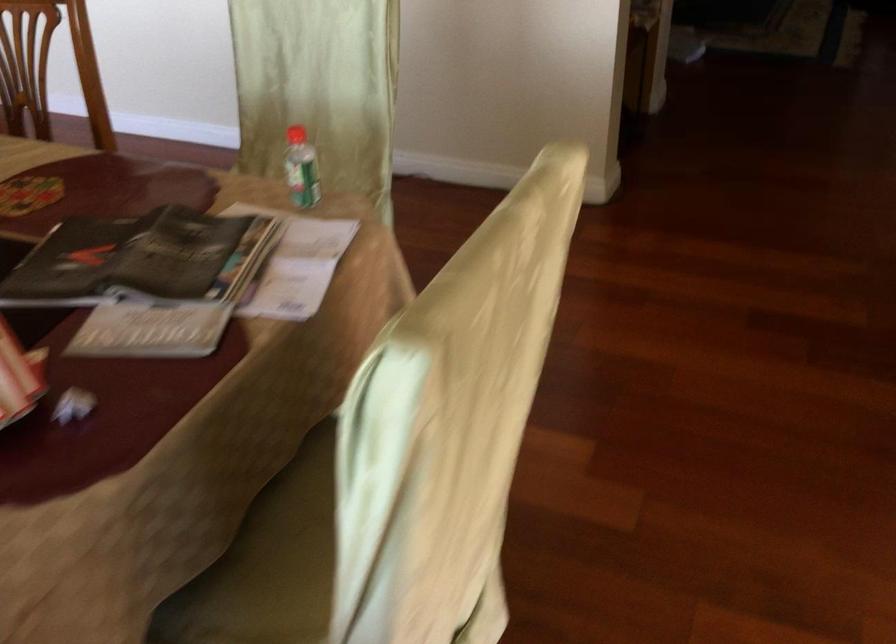
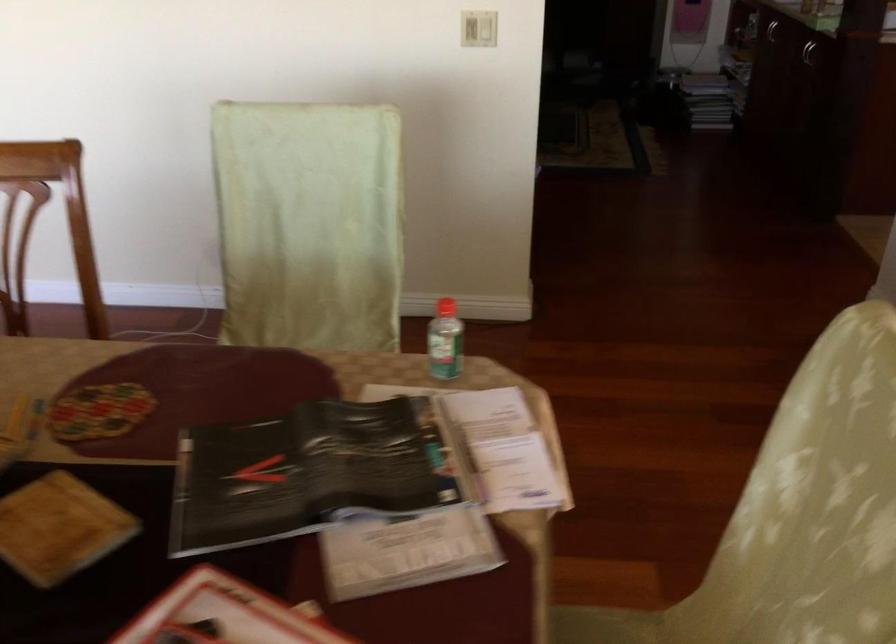
Where in the second image is the point corresponding to the point at 293,167 from the first image?

(444, 341)